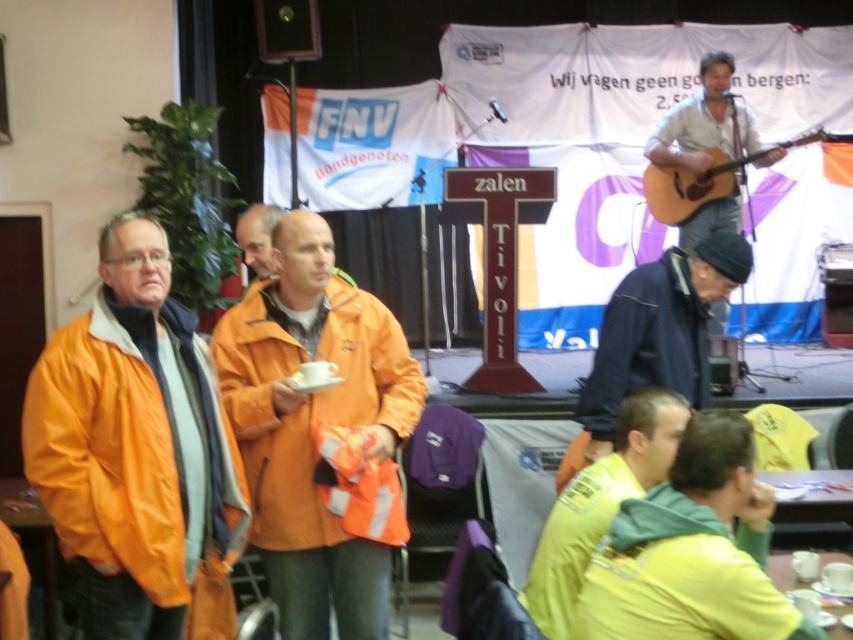
Measure the distance from orange matte jacket at center to yellow fabric at lower right.

They are 28.44 inches apart.

Does orange matte jacket at center come behind yellow fabric at lower right?

Yes, it is.

Describe the element at coordinates (308, 401) in the screenshot. This screenshot has height=640, width=853. I see `orange matte jacket at center` at that location.

Find the location of a particular element. The height and width of the screenshot is (640, 853). orange matte jacket at center is located at coordinates (308, 401).

Does point (234, 353) come behind point (715, 193)?

No.

Does orange matte jacket at center appear on the left side of acoustic wood guitar at upper right?

Indeed, orange matte jacket at center is positioned on the left side of acoustic wood guitar at upper right.

Locate an element on the screen. The width and height of the screenshot is (853, 640). orange matte jacket at center is located at coordinates (308, 401).

Can you confirm if yellow fabric at lower right is positioned to the right of white matte guitar at upper right?

Incorrect, yellow fabric at lower right is not on the right side of white matte guitar at upper right.

Measure the distance between yellow fabric at lower right and camera.

A distance of 2.32 meters exists between yellow fabric at lower right and camera.

Between point (537, 563) and point (693, 145), which one is positioned behind?

Point (693, 145)

Image resolution: width=853 pixels, height=640 pixels. Identify the location of yellow fabric at lower right. (601, 502).